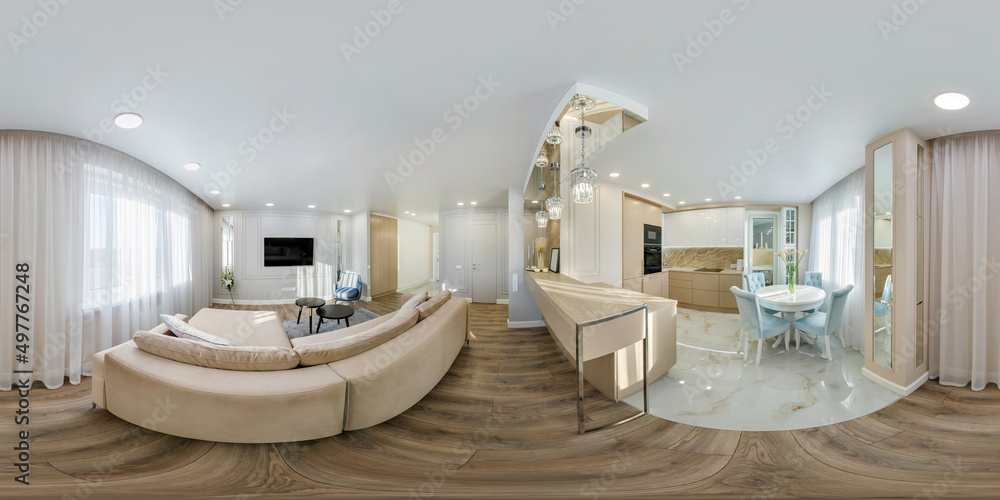
At what (x,y) coordinates should I click in order to perform the action: click on curtain. Please return your answer as a coordinate pair (x, y). Looking at the image, I should click on (68, 234).